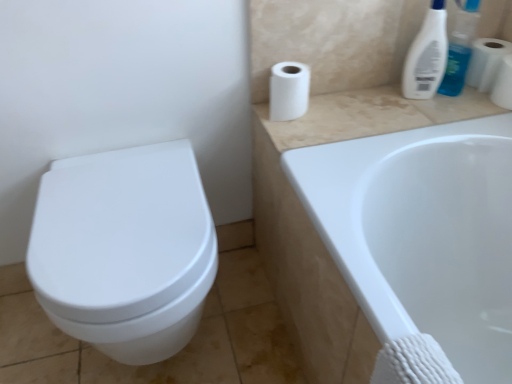
I want to click on free space above beige marble counter top at upper right (from a real-world perspective), so click(375, 97).